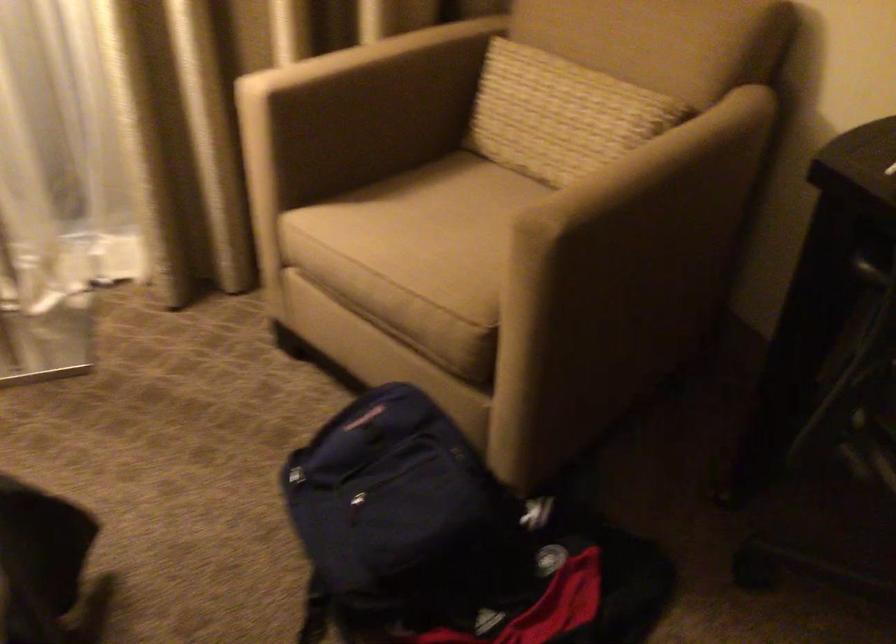
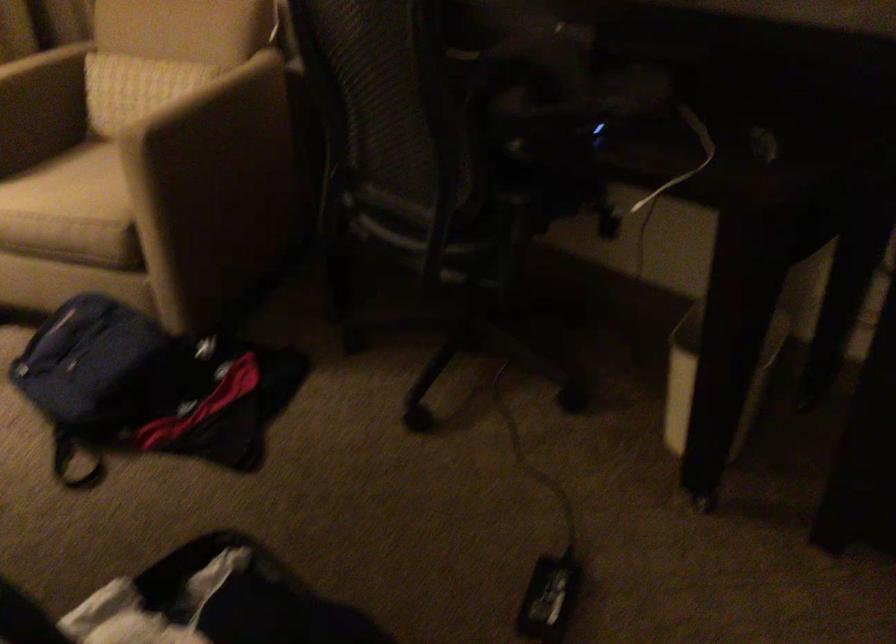
Question: The camera is either moving clockwise (left) or counter-clockwise (right) around the object. The first image is from the beginning of the video and the second image is from the end. Is the camera moving left or right when shooting the video?

Choices:
 (A) Left
 (B) Right

Answer: (A)